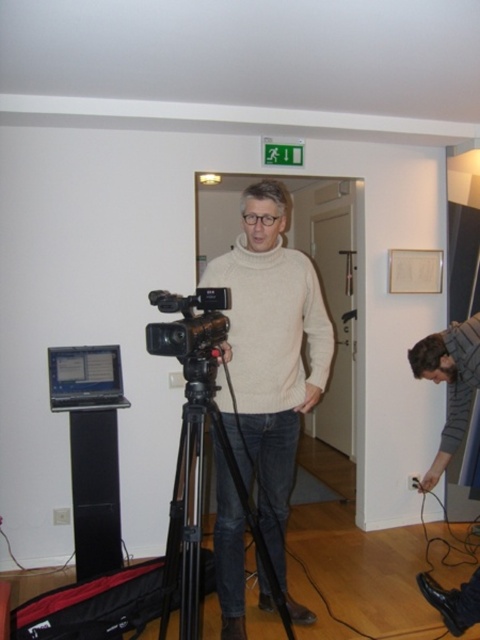
You are a camera operator who needs to adjust the focus on the camera. The focus ring is located on the black matte tripod at center. You are currently holding the light beige sweater at center. Can you reach the focus ring without moving your position?

The distance between the light beige sweater at center and the black matte tripod at center is 10.88 inches. Since the focus ring is on the black matte tripod at center, you can likely reach it from your current position as 10.88 inches is a short distance.

You are a camera operator adjusting the focus for the video recording. There are two points in the scene labeled as point (219, 509) and point (285, 625). Which point should you focus on first to ensure the subject closest to the camera is in clear view?

Point (219, 509) is further to the camera than point (285, 625), so you should focus on point (219, 509) first to ensure the subject closest to the camera is in clear view.

You are a fashion designer who needs to place a new accessory between the light beige sweater at center and the striped sweater at lower right. Given their current positions, can you fit the accessory in the space between them?

The light beige sweater at center and striped sweater at lower right are 36.91 inches apart from each other. Since 36.91 inches is a significant distance, the accessory can easily fit between them.